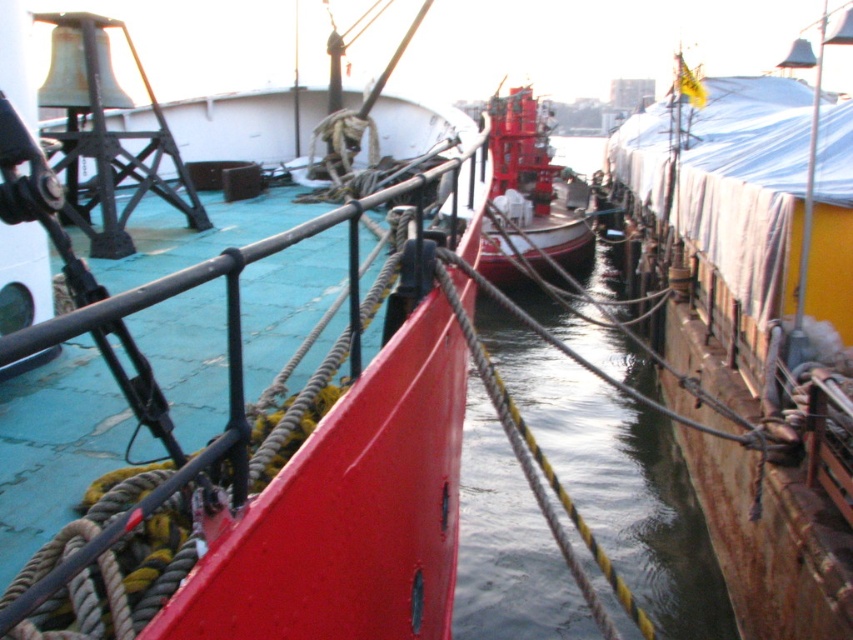
Question: Among these objects, which one is nearest to the camera?

Choices:
 (A) shiny red boat at center
 (B) smooth red boat at center

Answer: (B)

Question: Does rusty metal boat at right appear under shiny red boat at center?

Choices:
 (A) no
 (B) yes

Answer: (B)

Question: Estimate the real-world distances between objects in this image. Which object is closer to the shiny red boat at center?

Choices:
 (A) rusty metal boat at right
 (B) smooth red boat at center

Answer: (A)

Question: Which of these objects is positioned farthest from the smooth red boat at center?

Choices:
 (A) rusty metal boat at right
 (B) shiny red boat at center

Answer: (B)

Question: Does rusty metal boat at right have a greater width compared to smooth red boat at center?

Choices:
 (A) no
 (B) yes

Answer: (B)

Question: Can you confirm if rusty metal boat at right is bigger than smooth red boat at center?

Choices:
 (A) yes
 (B) no

Answer: (A)